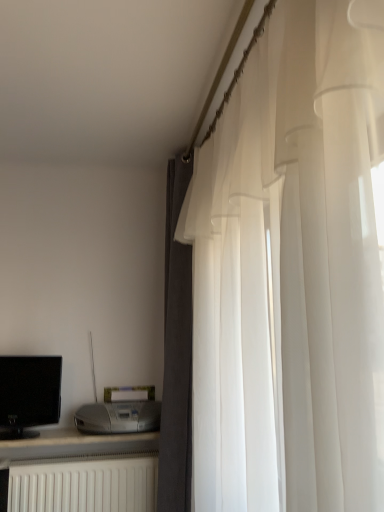
What do you see at coordinates (176, 353) in the screenshot? I see `dark gray fabric curtain at right, the second curtain when ordered from front to back` at bounding box center [176, 353].

From the picture: How much space does white sheer curtain at right, arranged as the second curtain when viewed from the back, occupy vertically?

It is 1.74 meters.

I want to click on dark gray fabric curtain at right, the second curtain when ordered from front to back, so click(x=176, y=353).

In the scene shown: Which point is more forward, (282, 469) or (170, 486)?

The point (282, 469) is closer to the camera.

From a real-world perspective, relative to dark gray fabric curtain at right, which is counted as the 1th curtain, starting from the back, is white sheer curtain at right, arranged as the second curtain when viewed from the back, vertically above or below?

From a real-world perspective, white sheer curtain at right, arranged as the second curtain when viewed from the back, is physically above dark gray fabric curtain at right, which is counted as the 1th curtain, starting from the back.

Can you tell me how much white sheer curtain at right, the 1th curtain in the front-to-back sequence, and dark gray fabric curtain at right, the second curtain when ordered from front to back, differ in facing direction?

The angle between the facing direction of white sheer curtain at right, the 1th curtain in the front-to-back sequence, and the facing direction of dark gray fabric curtain at right, the second curtain when ordered from front to back, is 0.000309 degrees.

Can you confirm if white sheer curtain at right, arranged as the second curtain when viewed from the back, is bigger than dark gray fabric curtain at right, the second curtain when ordered from front to back?

Indeed, white sheer curtain at right, arranged as the second curtain when viewed from the back, has a larger size compared to dark gray fabric curtain at right, the second curtain when ordered from front to back.

Is white sheer curtain at right, the 1th curtain in the front-to-back sequence, next to black glossy computer monitor at left and touching it?

No, white sheer curtain at right, the 1th curtain in the front-to-back sequence, is not in contact with black glossy computer monitor at left.

Considering the positions of objects white sheer curtain at right, arranged as the second curtain when viewed from the back, and black glossy computer monitor at left in the image provided, who is in front, white sheer curtain at right, arranged as the second curtain when viewed from the back, or black glossy computer monitor at left?

white sheer curtain at right, arranged as the second curtain when viewed from the back.

Considering the relative positions of white sheer curtain at right, the 1th curtain in the front-to-back sequence, and black glossy computer monitor at left in the image provided, is white sheer curtain at right, the 1th curtain in the front-to-back sequence, to the right of black glossy computer monitor at left from the viewer's perspective?

Indeed, white sheer curtain at right, the 1th curtain in the front-to-back sequence, is positioned on the right side of black glossy computer monitor at left.

Is white sheer curtain at right, the 1th curtain in the front-to-back sequence, oriented towards black glossy computer monitor at left?

No, white sheer curtain at right, the 1th curtain in the front-to-back sequence, does not turn towards black glossy computer monitor at left.

From a real-world perspective, who is located higher, black glossy computer monitor at left or white sheer curtain at right, arranged as the second curtain when viewed from the back?

white sheer curtain at right, arranged as the second curtain when viewed from the back, from a real-world perspective.

From the image's perspective, would you say black glossy computer monitor at left is positioned over white sheer curtain at right, the 1th curtain in the front-to-back sequence?

Actually, black glossy computer monitor at left appears below white sheer curtain at right, the 1th curtain in the front-to-back sequence, in the image.

Could you tell me if black glossy computer monitor at left is facing white sheer curtain at right, arranged as the second curtain when viewed from the back?

No.

Does black glossy computer monitor at left appear on the right side of white sheer curtain at right, arranged as the second curtain when viewed from the back?

No, black glossy computer monitor at left is not to the right of white sheer curtain at right, arranged as the second curtain when viewed from the back.

From a real-world perspective, which is physically below, satin silver printer at lower left or white matte radiator at lower left?

white matte radiator at lower left, from a real-world perspective.

From their relative heights in the image, would you say satin silver printer at lower left is taller or shorter than white matte radiator at lower left?

In the image, satin silver printer at lower left appears to be shorter than white matte radiator at lower left.

Is white matte radiator at lower left a part of satin silver printer at lower left?

No, white matte radiator at lower left is not surrounded by satin silver printer at lower left.

Considering the points (100, 410) and (134, 483), which point is in front, point (100, 410) or point (134, 483)?

The point (134, 483) is more forward.

Considering the relative sizes of white sheer curtain at right, the 1th curtain in the front-to-back sequence, and white matte radiator at lower left in the image provided, is white sheer curtain at right, the 1th curtain in the front-to-back sequence, taller than white matte radiator at lower left?

Correct, white sheer curtain at right, the 1th curtain in the front-to-back sequence, is much taller as white matte radiator at lower left.

Can you tell me how much white sheer curtain at right, the 1th curtain in the front-to-back sequence, and white matte radiator at lower left differ in facing direction?

The angle between the facing direction of white sheer curtain at right, the 1th curtain in the front-to-back sequence, and the facing direction of white matte radiator at lower left is 91.5 degrees.

Identify the location of curtain that is the 2nd object above the white matte radiator at lower left (from a real-world perspective). The height and width of the screenshot is (512, 384). (292, 271).

Which is more distant, (225, 209) or (125, 504)?

The point (125, 504) is behind.

Can you confirm if black glossy computer monitor at left is shorter than dark gray fabric curtain at right, which is counted as the 1th curtain, starting from the back?

Indeed, black glossy computer monitor at left has a lesser height compared to dark gray fabric curtain at right, which is counted as the 1th curtain, starting from the back.

In the image, is black glossy computer monitor at left positioned in front of or behind dark gray fabric curtain at right, the second curtain when ordered from front to back?

black glossy computer monitor at left is behind dark gray fabric curtain at right, the second curtain when ordered from front to back.

In the scene shown: Is black glossy computer monitor at left outside of dark gray fabric curtain at right, which is counted as the 1th curtain, starting from the back?

black glossy computer monitor at left is positioned outside dark gray fabric curtain at right, which is counted as the 1th curtain, starting from the back.

Looking at their sizes, would you say black glossy computer monitor at left is wider or thinner than dark gray fabric curtain at right, the second curtain when ordered from front to back?

black glossy computer monitor at left is thinner than dark gray fabric curtain at right, the second curtain when ordered from front to back.

In terms of width, does black glossy computer monitor at left look wider or thinner when compared to satin silver printer at lower left?

black glossy computer monitor at left is thinner than satin silver printer at lower left.

From the image's perspective, which is above, black glossy computer monitor at left or satin silver printer at lower left?

black glossy computer monitor at left is shown above in the image.

Considering the positions of objects black glossy computer monitor at left and satin silver printer at lower left in the image provided, who is more to the left, black glossy computer monitor at left or satin silver printer at lower left?

Positioned to the left is black glossy computer monitor at left.

From a real-world perspective, which is physically below, black glossy computer monitor at left or satin silver printer at lower left?

In real-world perspective, satin silver printer at lower left is lower.

Identify the location of curtain above the dark gray fabric curtain at right, the second curtain when ordered from front to back (from the image's perspective). The width and height of the screenshot is (384, 512). (292, 271).

The width and height of the screenshot is (384, 512). I want to click on computer monitor directly beneath the white sheer curtain at right, the 1th curtain in the front-to-back sequence (from a real-world perspective), so click(x=29, y=394).

When comparing their distances from black glossy computer monitor at left, does satin silver printer at lower left or dark gray fabric curtain at right, the second curtain when ordered from front to back, seem further?

The object further to black glossy computer monitor at left is dark gray fabric curtain at right, the second curtain when ordered from front to back.

Looking at the image, which one is located closer to white sheer curtain at right, arranged as the second curtain when viewed from the back, satin silver printer at lower left or dark gray fabric curtain at right, the second curtain when ordered from front to back?

The object closer to white sheer curtain at right, arranged as the second curtain when viewed from the back, is dark gray fabric curtain at right, the second curtain when ordered from front to back.

Looking at the image, which one is located further to white matte radiator at lower left, white sheer curtain at right, arranged as the second curtain when viewed from the back, or satin silver printer at lower left?

The object further to white matte radiator at lower left is white sheer curtain at right, arranged as the second curtain when viewed from the back.

When comparing their distances from white sheer curtain at right, the 1th curtain in the front-to-back sequence, does black glossy computer monitor at left or satin silver printer at lower left seem further?

The object further to white sheer curtain at right, the 1th curtain in the front-to-back sequence, is black glossy computer monitor at left.

Consider the image. Looking at the image, which one is located closer to black glossy computer monitor at left, white sheer curtain at right, arranged as the second curtain when viewed from the back, or white matte radiator at lower left?

white matte radiator at lower left lies closer to black glossy computer monitor at left than the other object.

From the image, which object appears to be nearer to dark gray fabric curtain at right, which is counted as the 1th curtain, starting from the back, white sheer curtain at right, the 1th curtain in the front-to-back sequence, or black glossy computer monitor at left?

Among the two, black glossy computer monitor at left is located nearer to dark gray fabric curtain at right, which is counted as the 1th curtain, starting from the back.

Considering their positions, is dark gray fabric curtain at right, the second curtain when ordered from front to back, positioned closer to white matte radiator at lower left than white sheer curtain at right, arranged as the second curtain when viewed from the back?

Based on the image, dark gray fabric curtain at right, the second curtain when ordered from front to back, appears to be nearer to white matte radiator at lower left.

When comparing their distances from white sheer curtain at right, the 1th curtain in the front-to-back sequence, does white matte radiator at lower left or dark gray fabric curtain at right, which is counted as the 1th curtain, starting from the back, seem further?

white matte radiator at lower left is positioned further to the anchor white sheer curtain at right, the 1th curtain in the front-to-back sequence.

Identify the location of appliance between white sheer curtain at right, arranged as the second curtain when viewed from the back, and black glossy computer monitor at left, along the z-axis. Image resolution: width=384 pixels, height=512 pixels. (118, 417).

At what (x,y) coordinates should I click in order to perform the action: click on curtain between white sheer curtain at right, arranged as the second curtain when viewed from the back, and white matte radiator at lower left in the front-back direction. Please return your answer as a coordinate pair (x, y). This screenshot has height=512, width=384. Looking at the image, I should click on (176, 353).

Find the location of a particular element. curtain positioned between white sheer curtain at right, the 1th curtain in the front-to-back sequence, and satin silver printer at lower left from near to far is located at coordinates (176, 353).

The image size is (384, 512). I want to click on radiator between white sheer curtain at right, arranged as the second curtain when viewed from the back, and satin silver printer at lower left from front to back, so click(85, 486).